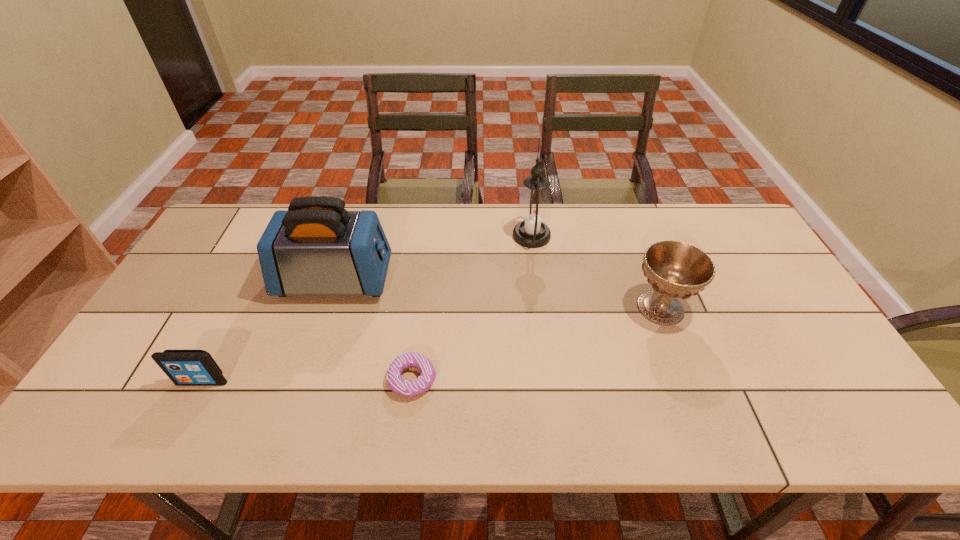
This screenshot has height=540, width=960. In order to click on vacant region at the left edge of the desktop in this screenshot , I will do `click(201, 286)`.

Find the location of a particular element. The width and height of the screenshot is (960, 540). vacant space at the right edge of the desktop is located at coordinates (773, 287).

At what (x,y) coordinates should I click in order to perform the action: click on vacant region at the near right corner. Please return your answer as a coordinate pair (x, y). This screenshot has width=960, height=540. Looking at the image, I should click on (820, 423).

Where is `vacant area that lies between the oil lamp and the leftmost object`? vacant area that lies between the oil lamp and the leftmost object is located at coordinates (367, 309).

Find the location of `blank region between the second tallest object and the iPod`. blank region between the second tallest object and the iPod is located at coordinates (269, 330).

The height and width of the screenshot is (540, 960). Identify the location of vacant space in between the toaster and the doughnut. (373, 330).

In order to click on vacant point located between the doughnut and the leftmost object in this screenshot , I will do `click(307, 381)`.

At what (x,y) coordinates should I click in order to perform the action: click on vacant area that lies between the rightmost object and the second object from left to right. Please return your answer as a coordinate pair (x, y). Image resolution: width=960 pixels, height=540 pixels. Looking at the image, I should click on (498, 294).

Where is `free space between the second object from left to right and the chalice`? The image size is (960, 540). free space between the second object from left to right and the chalice is located at coordinates (498, 294).

Find the location of a particular element. This screenshot has height=540, width=960. free space between the tallest object and the fourth object from right to left is located at coordinates (434, 258).